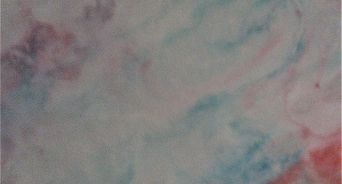
Locate an element on the screen. artwork is located at coordinates (190, 73).